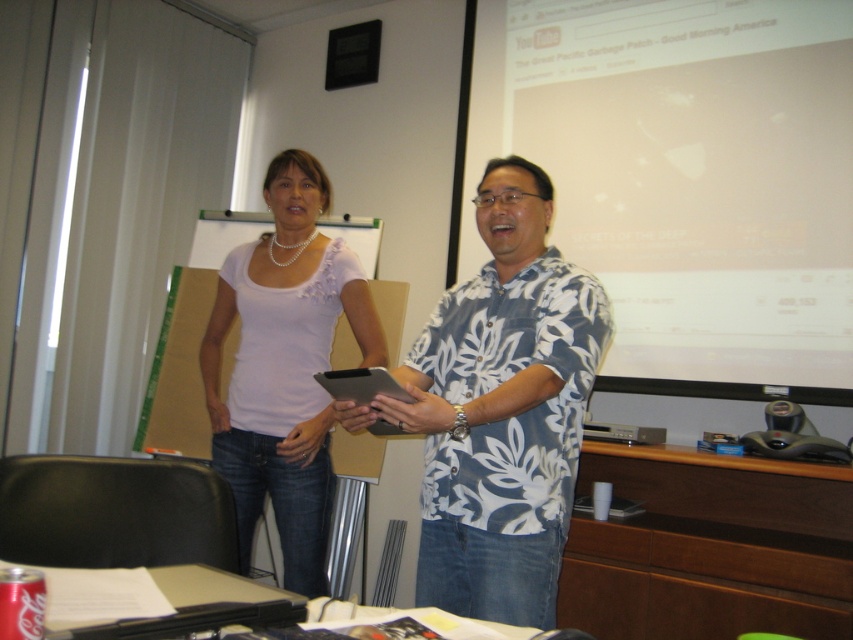
Question: Can you confirm if white matte projection screen at upper right is positioned above white floral shirt at center?

Choices:
 (A) yes
 (B) no

Answer: (A)

Question: Is white floral shirt at center below matte white blouse at center?

Choices:
 (A) yes
 (B) no

Answer: (B)

Question: Which point is farther from the camera taking this photo?

Choices:
 (A) (427, 561)
 (B) (717, 6)
 (C) (277, 531)

Answer: (C)

Question: Among these objects, which one is farthest from the camera?

Choices:
 (A) matte white blouse at center
 (B) white matte projection screen at upper right
 (C) white floral shirt at center

Answer: (B)

Question: Does white floral shirt at center lie in front of matte white blouse at center?

Choices:
 (A) yes
 (B) no

Answer: (A)

Question: Among these objects, which one is farthest from the camera?

Choices:
 (A) matte white blouse at center
 (B) white matte projection screen at upper right

Answer: (B)